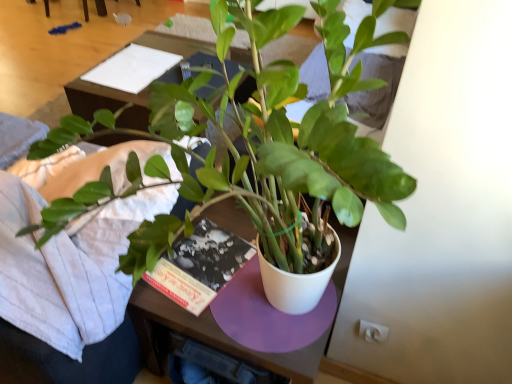
Question: Is green matte plant at center outside wooden table at center?

Choices:
 (A) yes
 (B) no

Answer: (A)

Question: Is green matte plant at center oriented towards wooden table at center?

Choices:
 (A) no
 (B) yes

Answer: (A)

Question: Can you confirm if green matte plant at center is smaller than wooden table at center?

Choices:
 (A) yes
 (B) no

Answer: (B)

Question: Is green matte plant at center shorter than wooden table at center?

Choices:
 (A) yes
 (B) no

Answer: (B)

Question: Can you confirm if green matte plant at center is wider than wooden table at center?

Choices:
 (A) yes
 (B) no

Answer: (A)

Question: From the image's perspective, relative to green matte plant at center, is wooden table at center above or below?

Choices:
 (A) above
 (B) below

Answer: (A)

Question: Is wooden table at center spatially inside green matte plant at center, or outside of it?

Choices:
 (A) inside
 (B) outside

Answer: (B)

Question: Is wooden table at center in front of or behind green matte plant at center in the image?

Choices:
 (A) behind
 (B) front

Answer: (A)

Question: Does point (95, 94) appear closer or farther from the camera than point (361, 24)?

Choices:
 (A) farther
 (B) closer

Answer: (A)

Question: From the image's perspective, is white paper at upper center positioned above or below wooden table at center?

Choices:
 (A) above
 (B) below

Answer: (A)

Question: Is white paper at upper center bigger or smaller than wooden table at center?

Choices:
 (A) big
 (B) small

Answer: (B)

Question: From a real-world perspective, is white paper at upper center above or below wooden table at center?

Choices:
 (A) below
 (B) above

Answer: (B)

Question: Do you think white paper at upper center is within wooden table at center, or outside of it?

Choices:
 (A) inside
 (B) outside

Answer: (A)

Question: In the image, is white paper at upper center on the left side or the right side of green matte plant at center?

Choices:
 (A) left
 (B) right

Answer: (A)

Question: Is white paper at upper center wider or thinner than green matte plant at center?

Choices:
 (A) thin
 (B) wide

Answer: (A)